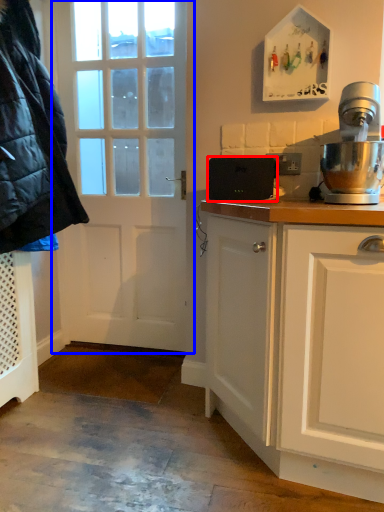
Question: Among these objects, which one is nearest to the camera, appliance (highlighted by a red box) or door (highlighted by a blue box)?

Choices:
 (A) appliance
 (B) door

Answer: (A)